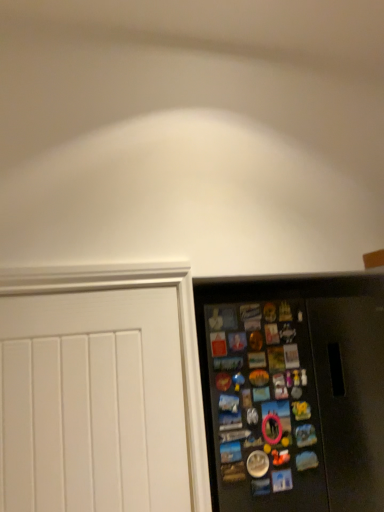
What is the approximate height of black matte refrigerator at lower right?

The height of black matte refrigerator at lower right is 3.88 feet.

What do you see at coordinates (293, 391) in the screenshot? The height and width of the screenshot is (512, 384). I see `black matte refrigerator at lower right` at bounding box center [293, 391].

Image resolution: width=384 pixels, height=512 pixels. What are the coordinates of `black matte refrigerator at lower right` in the screenshot? It's located at (293, 391).

Locate an element on the screen. The image size is (384, 512). black matte refrigerator at lower right is located at coordinates (293, 391).